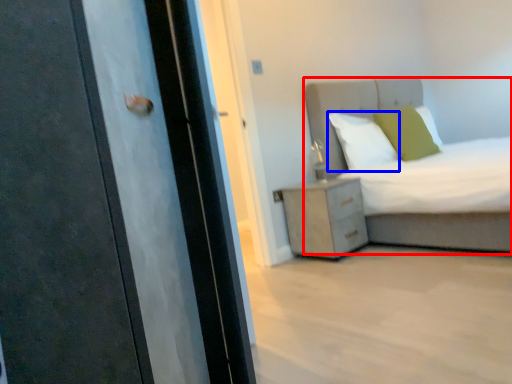
Question: Among these objects, which one is farthest to the camera, bed (highlighted by a red box) or pillow (highlighted by a blue box)?

Choices:
 (A) bed
 (B) pillow

Answer: (B)